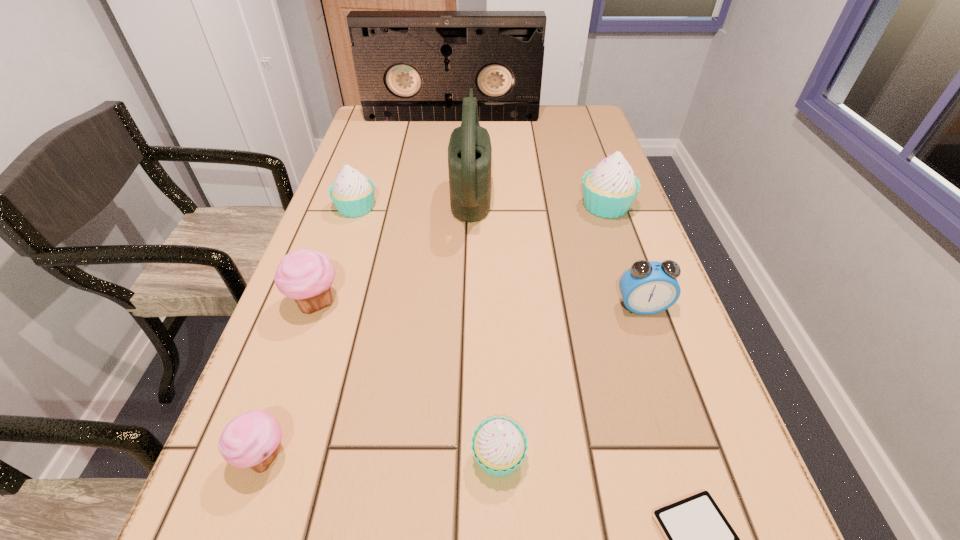
Where is `vacant area between the nearer pink cupcake and the watering can`? This screenshot has width=960, height=540. vacant area between the nearer pink cupcake and the watering can is located at coordinates (368, 323).

Locate an element on the screen. The height and width of the screenshot is (540, 960). free spot between the tallest cupcake and the bigger pink cupcake is located at coordinates (461, 254).

In order to click on free area in between the alarm clock and the seventh shortest object in this screenshot , I will do `click(624, 256)`.

The height and width of the screenshot is (540, 960). In order to click on vacant space in between the leftmost white cupcake and the alarm clock in this screenshot , I will do `click(499, 257)`.

The image size is (960, 540). I want to click on empty space that is in between the leftmost white cupcake and the nearer pink cupcake, so click(x=310, y=332).

The height and width of the screenshot is (540, 960). What are the coordinates of `free point between the eighth shortest object and the alarm clock` in the screenshot? It's located at (557, 248).

The width and height of the screenshot is (960, 540). Identify the location of free space between the leftmost white cupcake and the third farthest cupcake. (336, 255).

Locate which object is the fifth closest to the biggest white cupcake. Please provide its 2D coordinates. Your answer should be formatted as a tuple, i.e. [(x, y)], where the tuple contains the x and y coordinates of a point satisfying the conditions above.

[(499, 445)]

This screenshot has height=540, width=960. What are the coordinates of `object that ranks as the eighth closest to the black videotape` in the screenshot? It's located at (699, 539).

The image size is (960, 540). Find the location of `cupcake identified as the closest to the nearer pink cupcake`. cupcake identified as the closest to the nearer pink cupcake is located at coordinates [x=305, y=275].